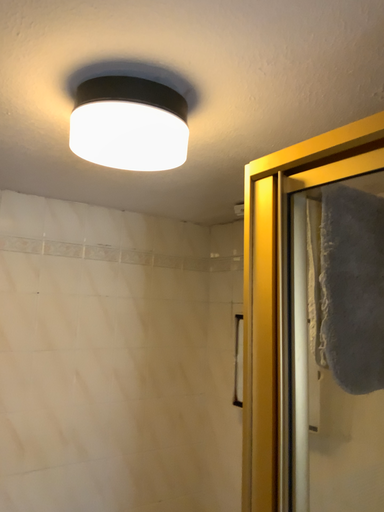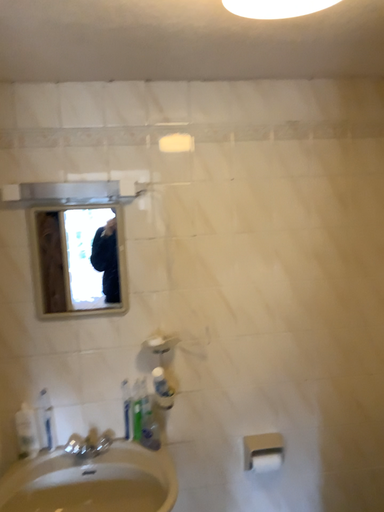
Question: How did the camera likely rotate when shooting the video?

Choices:
 (A) rotated right
 (B) rotated left

Answer: (B)